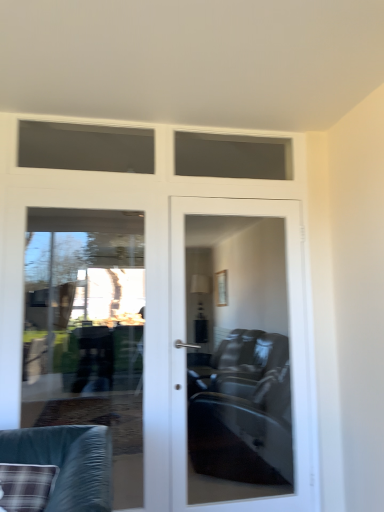
Where is `plaid fabric cushion at lower left`? plaid fabric cushion at lower left is located at coordinates (67, 463).

Describe the element at coordinates (239, 356) in the screenshot. I see `matte glass door at center` at that location.

The width and height of the screenshot is (384, 512). In order to click on clear glass door at left in this screenshot , I will do `click(87, 330)`.

This screenshot has width=384, height=512. What do you see at coordinates (87, 330) in the screenshot?
I see `clear glass door at left` at bounding box center [87, 330].

Where is `plaid fabric cushion at lower left`? Image resolution: width=384 pixels, height=512 pixels. plaid fabric cushion at lower left is located at coordinates (67, 463).

From the image's perspective, which one is positioned higher, matte glass door at center or clear glass door at left?

clear glass door at left appears higher in the image.

Is matte glass door at center situated inside clear glass door at left or outside?

matte glass door at center is spatially situated outside clear glass door at left.

Is matte glass door at center positioned far away from clear glass door at left?

Indeed, matte glass door at center is not near clear glass door at left.

How many degrees apart are the facing directions of matte glass door at center and clear glass door at left?

matte glass door at center and clear glass door at left are facing 1.22 degrees away from each other.

Between matte glass door at center and plaid fabric cushion at lower left, which one appears on the left side from the viewer's perspective?

Answer: plaid fabric cushion at lower left.

Looking at this image, are matte glass door at center and plaid fabric cushion at lower left far apart?

Absolutely, matte glass door at center is distant from plaid fabric cushion at lower left.

From the picture: Is matte glass door at center oriented away from plaid fabric cushion at lower left?

No, matte glass door at center is not facing the opposite direction of plaid fabric cushion at lower left.

From a real-world perspective, which object stands above the other?

matte glass door at center is physically above.

Who is more distant, clear glass door at left or plaid fabric cushion at lower left?

clear glass door at left is behind.

Does clear glass door at left turn towards plaid fabric cushion at lower left?

Yes, clear glass door at left is facing plaid fabric cushion at lower left.

Can you confirm if clear glass door at left is smaller than plaid fabric cushion at lower left?

No.

Do you think clear glass door at left is within plaid fabric cushion at lower left, or outside of it?

clear glass door at left is outside plaid fabric cushion at lower left.

Is point (85, 433) closer or farther from the camera than point (117, 388)?

Point (85, 433) appears to be closer to the viewer than point (117, 388).

How different are the orientations of plaid fabric cushion at lower left and clear glass door at left in degrees?

A: They differ by 4.62 degrees in their facing directions.

From a real-world perspective, which object rests below the other?

plaid fabric cushion at lower left is physically lower.

Is plaid fabric cushion at lower left next to clear glass door at left?

No, plaid fabric cushion at lower left is not next to clear glass door at left.

Does clear glass door at left appear on the left side of matte glass door at center?

Yes, clear glass door at left is to the left of matte glass door at center.

Is clear glass door at left oriented towards matte glass door at center?

No.

Does clear glass door at left have a larger size compared to matte glass door at center?

Actually, clear glass door at left might be smaller than matte glass door at center.

From the image's perspective, which one is positioned lower, clear glass door at left or matte glass door at center?

matte glass door at center appears lower in the image.

From the image's perspective, is plaid fabric cushion at lower left positioned above or below matte glass door at center?

plaid fabric cushion at lower left is below matte glass door at center.

Is the surface of plaid fabric cushion at lower left in direct contact with matte glass door at center?

No, plaid fabric cushion at lower left is not making contact with matte glass door at center.

Is plaid fabric cushion at lower left in front of or behind matte glass door at center in the image?

plaid fabric cushion at lower left is positioned closer to the viewer than matte glass door at center.

Looking at this image, considering the sizes of plaid fabric cushion at lower left and matte glass door at center in the image, is plaid fabric cushion at lower left wider or thinner than matte glass door at center?

In the image, plaid fabric cushion at lower left appears to be wider than matte glass door at center.

This screenshot has width=384, height=512. Identify the location of door behind the clear glass door at left. (239, 356).

This screenshot has width=384, height=512. What are the coordinates of `door that appears on the right of plaid fabric cushion at lower left` in the screenshot? It's located at coord(239,356).

Estimate the real-world distances between objects in this image. Which object is closer to matte glass door at center, clear glass door at left or plaid fabric cushion at lower left?

The object closer to matte glass door at center is clear glass door at left.

Based on their spatial positions, is plaid fabric cushion at lower left or clear glass door at left further from matte glass door at center?

Based on the image, plaid fabric cushion at lower left appears to be further to matte glass door at center.

Considering their positions, is matte glass door at center positioned closer to plaid fabric cushion at lower left than clear glass door at left?

matte glass door at center is positioned closer to the anchor plaid fabric cushion at lower left.

Estimate the real-world distances between objects in this image. Which object is closer to clear glass door at left, plaid fabric cushion at lower left or matte glass door at center?

Among the two, matte glass door at center is located nearer to clear glass door at left.

Considering their positions, is clear glass door at left positioned closer to plaid fabric cushion at lower left than matte glass door at center?

The object closer to plaid fabric cushion at lower left is matte glass door at center.

Considering their positions, is matte glass door at center positioned closer to clear glass door at left than plaid fabric cushion at lower left?

matte glass door at center is positioned closer to the anchor clear glass door at left.

Where is `screen door situated between plaid fabric cushion at lower left and matte glass door at center from left to right`? screen door situated between plaid fabric cushion at lower left and matte glass door at center from left to right is located at coordinates (87, 330).